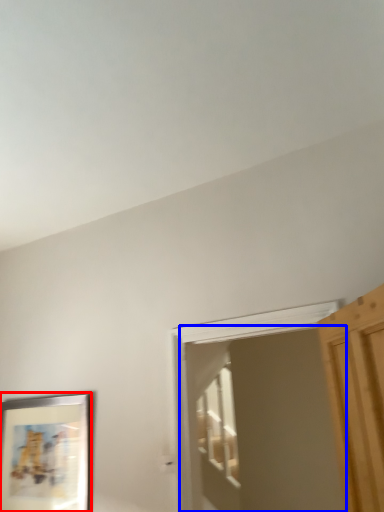
Question: Which of the following is the closest to the observer, picture frame (highlighted by a red box) or screen door (highlighted by a blue box)?

Choices:
 (A) picture frame
 (B) screen door

Answer: (B)